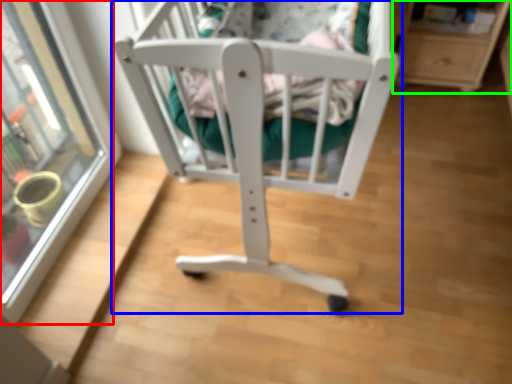
Question: Which is farther away from glass door (highlighted by a red box)? furniture (highlighted by a blue box) or shelf (highlighted by a green box)?

Choices:
 (A) furniture
 (B) shelf

Answer: (B)